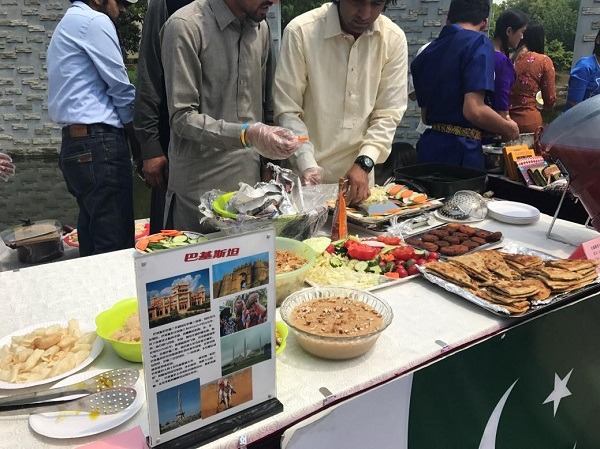
The width and height of the screenshot is (600, 449). I want to click on laminated sign, so click(173, 261).